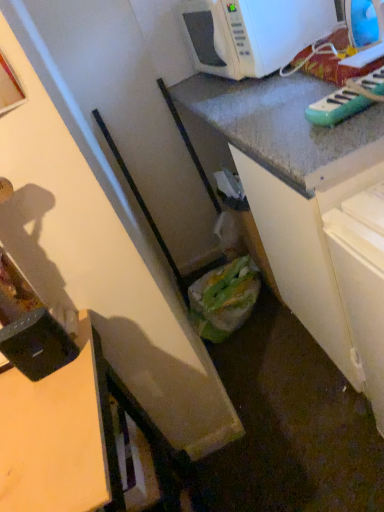
In order to click on black plastic container at lower left, which appears as the second appliance when viewed from the top in this screenshot , I will do `click(37, 345)`.

What is the approximate width of wooden desk at lower left?

19.99 inches.

What is the approximate height of white glossy microwave at upper right?

white glossy microwave at upper right is 11.27 inches in height.

What is the approximate width of green plastic toy keyboard at upper right, the 2th appliance in the left-to-right sequence?

It is 42.00 centimeters.

Locate an element on the screen. black plastic container at lower left, acting as the 1th appliance starting from the left is located at coordinates (37, 345).

Considering the sizes of objects white glossy microwave at upper right and wooden desk at lower left in the image provided, who is bigger, white glossy microwave at upper right or wooden desk at lower left?

wooden desk at lower left.

Does white glossy microwave at upper right have a greater height compared to wooden desk at lower left?

In fact, white glossy microwave at upper right may be shorter than wooden desk at lower left.

Is white glossy microwave at upper right shorter than black plastic container at lower left, which appears as the second appliance when viewed from the top?

In fact, white glossy microwave at upper right may be taller than black plastic container at lower left, which appears as the second appliance when viewed from the top.

Based on the photo, is white glossy microwave at upper right to the left of black plastic container at lower left, which appears as the second appliance when viewed from the top, from the viewer's perspective?

A: In fact, white glossy microwave at upper right is to the right of black plastic container at lower left, which appears as the second appliance when viewed from the top.

How distant is white glossy microwave at upper right from black plastic container at lower left, which appears as the second appliance when viewed from the top?

white glossy microwave at upper right is 1.15 meters from black plastic container at lower left, which appears as the second appliance when viewed from the top.

Between white glossy microwave at upper right and black plastic container at lower left, which appears as the second appliance when viewed from the top, which one has larger width?

Wider between the two is white glossy microwave at upper right.

How many degrees apart are the facing directions of green plastic bag at lower center and black plastic container at lower left, which appears as the second appliance when viewed from the top?

The angle between the facing direction of green plastic bag at lower center and the facing direction of black plastic container at lower left, which appears as the second appliance when viewed from the top, is 12.9 degrees.

Does green plastic bag at lower center turn towards black plastic container at lower left, the 1th appliance in the bottom-to-top sequence?

No, green plastic bag at lower center is not turned towards black plastic container at lower left, the 1th appliance in the bottom-to-top sequence.

Who is more distant, green plastic bag at lower center or black plastic container at lower left, which appears as the second appliance when viewed from the top?

green plastic bag at lower center is more distant.

Considering the sizes of objects black plastic container at lower left, acting as the 1th appliance starting from the left, and white glossy microwave at upper right in the image provided, who is taller, black plastic container at lower left, acting as the 1th appliance starting from the left, or white glossy microwave at upper right?

With more height is white glossy microwave at upper right.

From the image's perspective, is black plastic container at lower left, acting as the 1th appliance starting from the left, on top of white glossy microwave at upper right?

Incorrect, from the image's perspective, black plastic container at lower left, acting as the 1th appliance starting from the left, is lower than white glossy microwave at upper right.

Is black plastic container at lower left, which appears as the second appliance when viewed from the top, positioned behind white glossy microwave at upper right?

No, it is in front of white glossy microwave at upper right.

Find the location of a particular element. This screenshot has width=384, height=512. microwave oven that is on the right side of black plastic container at lower left, acting as the 1th appliance starting from the left is located at coordinates click(x=253, y=33).

Is green plastic toy keyboard at upper right, which is the second appliance from bottom to top, located within black plastic container at lower left, acting as the 1th appliance starting from the left?

That's incorrect, green plastic toy keyboard at upper right, which is the second appliance from bottom to top, is not inside black plastic container at lower left, acting as the 1th appliance starting from the left.

Considering the relative positions of black plastic container at lower left, the 1th appliance in the bottom-to-top sequence, and green plastic toy keyboard at upper right, the 2th appliance in the left-to-right sequence, in the image provided, is black plastic container at lower left, the 1th appliance in the bottom-to-top sequence, in front of green plastic toy keyboard at upper right, the 2th appliance in the left-to-right sequence,?

Yes.

From the image's perspective, which one is positioned higher, black plastic container at lower left, acting as the 1th appliance starting from the left, or green plastic toy keyboard at upper right, which is the second appliance from bottom to top?

From the image's view, green plastic toy keyboard at upper right, which is the second appliance from bottom to top, is above.

Considering the sizes of objects black plastic container at lower left, marked as the second appliance in a right-to-left arrangement, and green plastic toy keyboard at upper right, the first appliance viewed from the right, in the image provided, who is wider, black plastic container at lower left, marked as the second appliance in a right-to-left arrangement, or green plastic toy keyboard at upper right, the first appliance viewed from the right,?

Wider between the two is green plastic toy keyboard at upper right, the first appliance viewed from the right.

Which object is positioned more to the left, white glossy microwave at upper right or green plastic bag at lower center?

Positioned to the left is green plastic bag at lower center.

From the image's perspective, which object appears higher, white glossy microwave at upper right or green plastic bag at lower center?

white glossy microwave at upper right, from the image's perspective.

Where is `microwave oven located in front of the green plastic bag at lower center`? microwave oven located in front of the green plastic bag at lower center is located at coordinates (253, 33).

Which is in front, point (316, 12) or point (200, 311)?

The point (316, 12) is in front.

From a real-world perspective, is green plastic toy keyboard at upper right, the first appliance viewed from the right, under white glossy microwave at upper right?

Yes.

In the scene shown: Which object is closer to the camera taking this photo, green plastic toy keyboard at upper right, acting as the first appliance starting from the top, or white glossy microwave at upper right?

Positioned in front is green plastic toy keyboard at upper right, acting as the first appliance starting from the top.

How many degrees apart are the facing directions of green plastic toy keyboard at upper right, which is the second appliance from bottom to top, and white glossy microwave at upper right?

3.77 degrees.

Is green plastic toy keyboard at upper right, the first appliance viewed from the right, smaller than white glossy microwave at upper right?

Yes.

Identify the location of microwave oven that is above the wooden desk at lower left (from the image's perspective). The height and width of the screenshot is (512, 384). (253, 33).

Locate an element on the screen. appliance to the left of white glossy microwave at upper right is located at coordinates (37, 345).

Which object lies further to the anchor point white glossy microwave at upper right, black plastic container at lower left, acting as the 1th appliance starting from the left, or wooden desk at lower left?

wooden desk at lower left is further to white glossy microwave at upper right.

When comparing their distances from black plastic container at lower left, marked as the second appliance in a right-to-left arrangement, does green plastic bag at lower center or wooden desk at lower left seem further?

green plastic bag at lower center is further to black plastic container at lower left, marked as the second appliance in a right-to-left arrangement.

Which object lies further to the anchor point green plastic toy keyboard at upper right, which is the second appliance from bottom to top, white glossy microwave at upper right or black plastic container at lower left, the 1th appliance in the bottom-to-top sequence?

Based on the image, black plastic container at lower left, the 1th appliance in the bottom-to-top sequence, appears to be further to green plastic toy keyboard at upper right, which is the second appliance from bottom to top.

Looking at this image, when comparing their distances from wooden desk at lower left, does black plastic container at lower left, the 1th appliance in the bottom-to-top sequence, or green plastic toy keyboard at upper right, which is the second appliance from bottom to top, seem further?

green plastic toy keyboard at upper right, which is the second appliance from bottom to top, is further to wooden desk at lower left.

Based on their spatial positions, is green plastic toy keyboard at upper right, acting as the first appliance starting from the top, or black plastic container at lower left, marked as the second appliance in a right-to-left arrangement, further from green plastic bag at lower center?

The object further to green plastic bag at lower center is green plastic toy keyboard at upper right, acting as the first appliance starting from the top.

From the image, which object appears to be farther from black plastic container at lower left, the 1th appliance in the bottom-to-top sequence, wooden desk at lower left or white glossy microwave at upper right?

The object further to black plastic container at lower left, the 1th appliance in the bottom-to-top sequence, is white glossy microwave at upper right.

In the scene shown: From the image, which object appears to be farther from black plastic container at lower left, acting as the 1th appliance starting from the left, wooden desk at lower left or green plastic bag at lower center?

The object further to black plastic container at lower left, acting as the 1th appliance starting from the left, is green plastic bag at lower center.

Based on the photo, estimate the real-world distances between objects in this image. Which object is closer to green plastic toy keyboard at upper right, which is the second appliance from bottom to top, wooden desk at lower left or white glossy microwave at upper right?

Based on the image, white glossy microwave at upper right appears to be nearer to green plastic toy keyboard at upper right, which is the second appliance from bottom to top.

Where is `appliance between white glossy microwave at upper right and green plastic bag at lower center in the vertical direction`? The height and width of the screenshot is (512, 384). appliance between white glossy microwave at upper right and green plastic bag at lower center in the vertical direction is located at coordinates (337, 106).

Where is `garbage that lies between white glossy microwave at upper right and black plastic container at lower left, which appears as the second appliance when viewed from the top, from top to bottom`? The width and height of the screenshot is (384, 512). garbage that lies between white glossy microwave at upper right and black plastic container at lower left, which appears as the second appliance when viewed from the top, from top to bottom is located at coordinates coord(224,298).

This screenshot has height=512, width=384. Find the location of `appliance between black plastic container at lower left, marked as the second appliance in a right-to-left arrangement, and green plastic bag at lower center in the front-back direction`. appliance between black plastic container at lower left, marked as the second appliance in a right-to-left arrangement, and green plastic bag at lower center in the front-back direction is located at coordinates tap(337, 106).

Find the location of `appliance between green plastic toy keyboard at upper right, which is the second appliance from bottom to top, and wooden desk at lower left from top to bottom`. appliance between green plastic toy keyboard at upper right, which is the second appliance from bottom to top, and wooden desk at lower left from top to bottom is located at coordinates (37, 345).